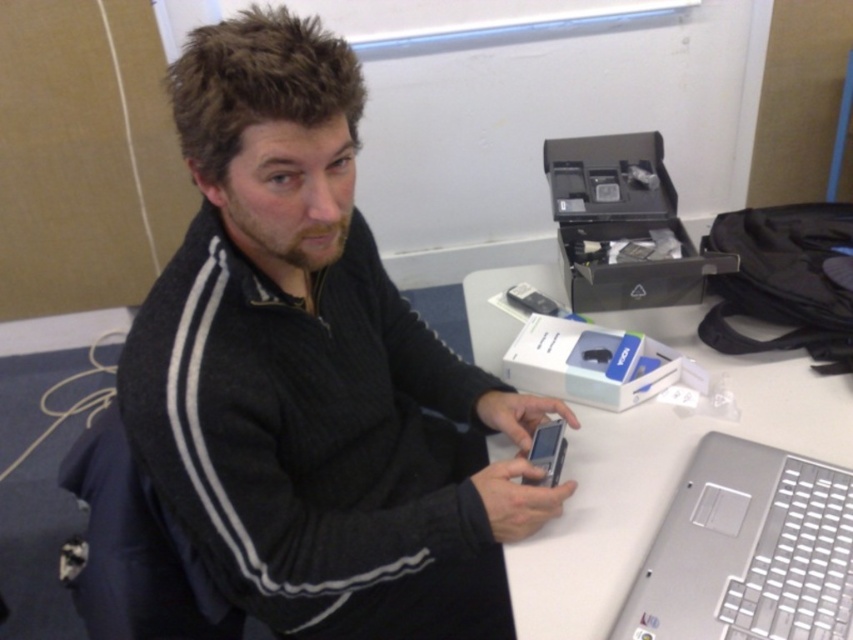
Question: Which of these objects is positioned closest to the satin silver phone at center?

Choices:
 (A) silver metallic laptop at lower right
 (B) silver metallic table at center
 (C) black matte sweater at upper left

Answer: (B)

Question: Can you confirm if black matte sweater at upper left is smaller than silver metallic table at center?

Choices:
 (A) no
 (B) yes

Answer: (A)

Question: Which is nearer to the black matte sweater at upper left?

Choices:
 (A) silver metallic laptop at lower right
 (B) silver metallic table at center
 (C) satin silver phone at center

Answer: (B)

Question: Is silver metallic table at center above satin silver phone at center?

Choices:
 (A) no
 (B) yes

Answer: (B)

Question: Is silver metallic table at center positioned in front of silver metallic laptop at lower right?

Choices:
 (A) no
 (B) yes

Answer: (A)

Question: Which of the following is the closest to the observer?

Choices:
 (A) (451, 472)
 (B) (730, 508)

Answer: (B)